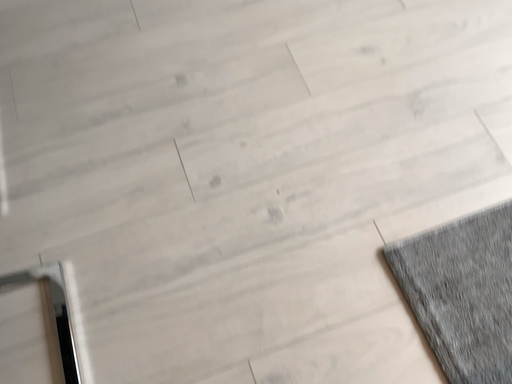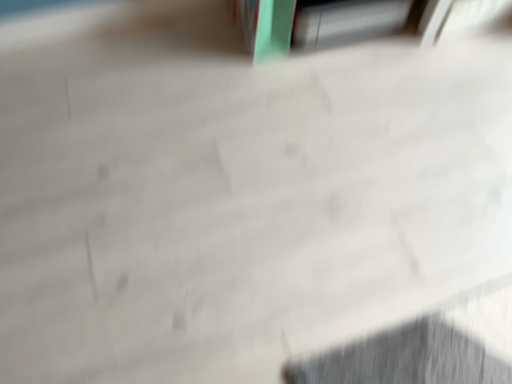
Question: How did the camera likely rotate when shooting the video?

Choices:
 (A) rotated downward
 (B) rotated upward

Answer: (B)